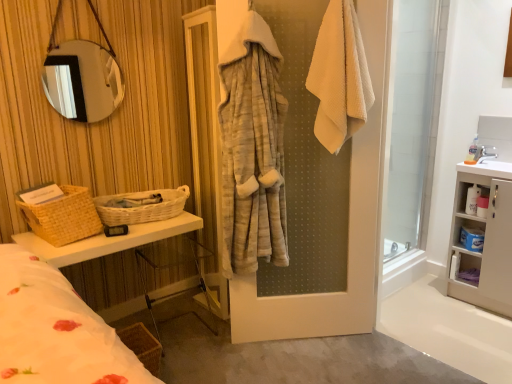
Locate an element on the screen. This screenshot has height=384, width=512. blank space above white glossy sink at upper right (from a real-world perspective) is located at coordinates (487, 160).